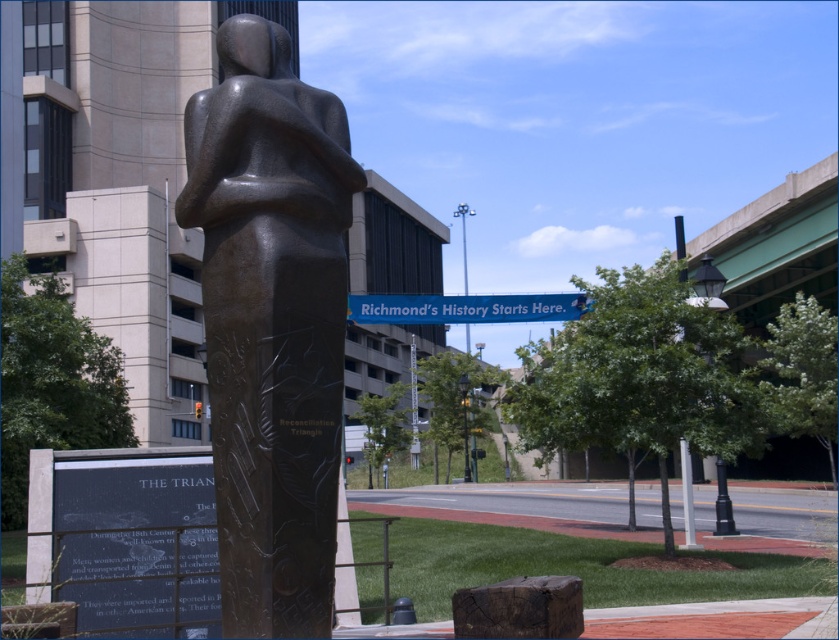
Is bronze statue at center to the right of blue plastic banner at center from the viewer's perspective?

In fact, bronze statue at center is to the left of blue plastic banner at center.

Can you confirm if bronze statue at center is taller than blue plastic banner at center?

Yes, bronze statue at center is taller than blue plastic banner at center.

Looking at this image, who is more forward, (258, 541) or (367, 323)?

Point (258, 541) is in front.

At what (x,y) coordinates should I click in order to perform the action: click on bronze statue at center. Please return your answer as a coordinate pair (x, y). The image size is (839, 640). Looking at the image, I should click on (271, 323).